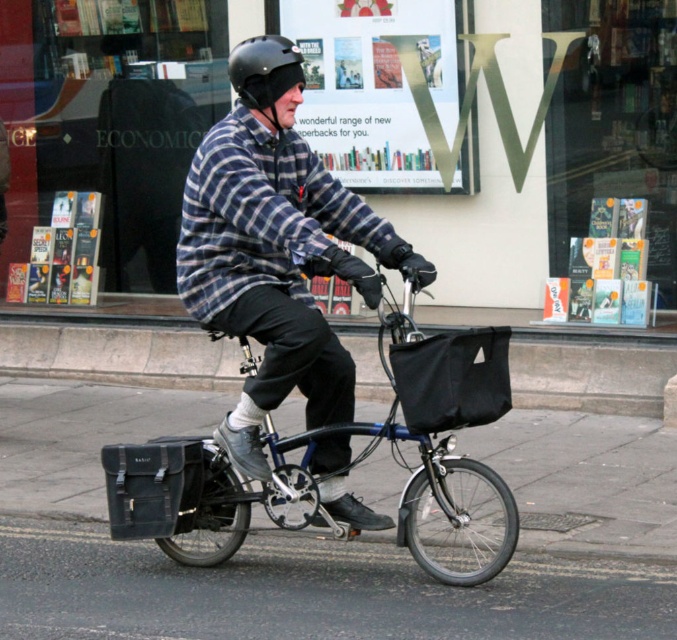
Can you confirm if plaid flannel shirt at center is positioned to the right of metallic blue bicycle at center?

In fact, plaid flannel shirt at center is to the left of metallic blue bicycle at center.

Is point (255, 49) in front of point (169, 538)?

Yes, point (255, 49) is closer to viewer.

Who is more distant from viewer, (x=368, y=273) or (x=437, y=496)?

The point (x=437, y=496) is more distant.

Locate an element on the screen. plaid flannel shirt at center is located at coordinates (276, 248).

Can you confirm if plaid flannel shirt at center is thinner than black matte helmet at center?

No, plaid flannel shirt at center is not thinner than black matte helmet at center.

Based on the photo, between plaid flannel shirt at center and black matte helmet at center, which one is positioned lower?

Positioned lower is plaid flannel shirt at center.

Is point (309, 262) closer to camera compared to point (261, 109)?

That is True.

You are a GUI agent. You are given a task and a screenshot of the screen. Output one action in this format:
    pyautogui.click(x=<x>, y=<y>)
    Task: Click on the plaid flannel shirt at center
    The image size is (677, 640).
    Given the screenshot: What is the action you would take?
    pyautogui.click(x=276, y=248)

Does metallic blue bicycle at center have a greater height compared to black matte helmet at center?

Correct, metallic blue bicycle at center is much taller as black matte helmet at center.

Between metallic blue bicycle at center and black matte helmet at center, which one appears on the left side from the viewer's perspective?

black matte helmet at center is more to the left.

Describe the element at coordinates (376, 445) in the screenshot. I see `metallic blue bicycle at center` at that location.

The image size is (677, 640). I want to click on metallic blue bicycle at center, so click(x=376, y=445).